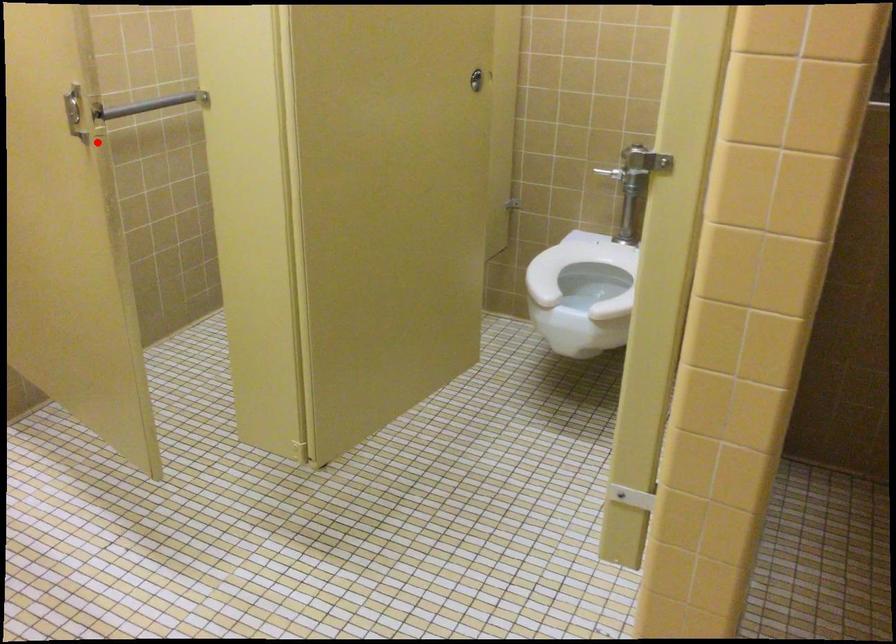
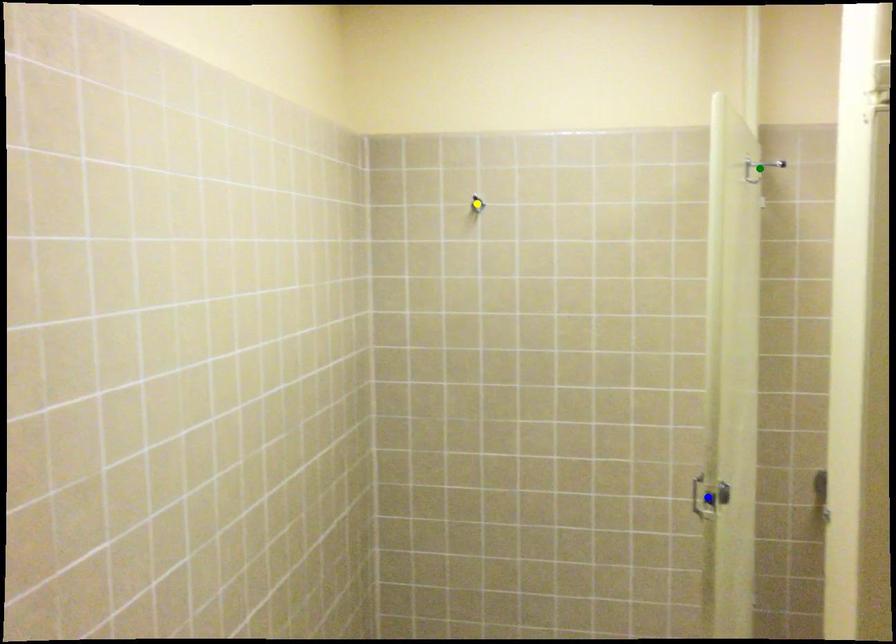
Question: I am providing you with two images of the same scene from different viewpoints. A red point is marked on the first image. You are given multiple points on the second image. Can you choose the point in image 2 that corresponds to the point in image 1?

Choices:
 (A) blue point
 (B) yellow point
 (C) green point

Answer: (A)